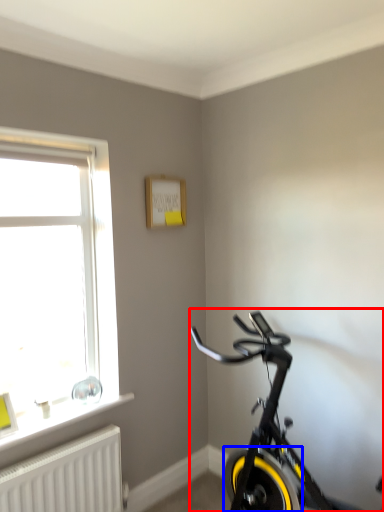
Question: Which of the following is the closest to the observer, bicycle (highlighted by a red box) or bicycle wheel (highlighted by a blue box)?

Choices:
 (A) bicycle
 (B) bicycle wheel

Answer: (A)